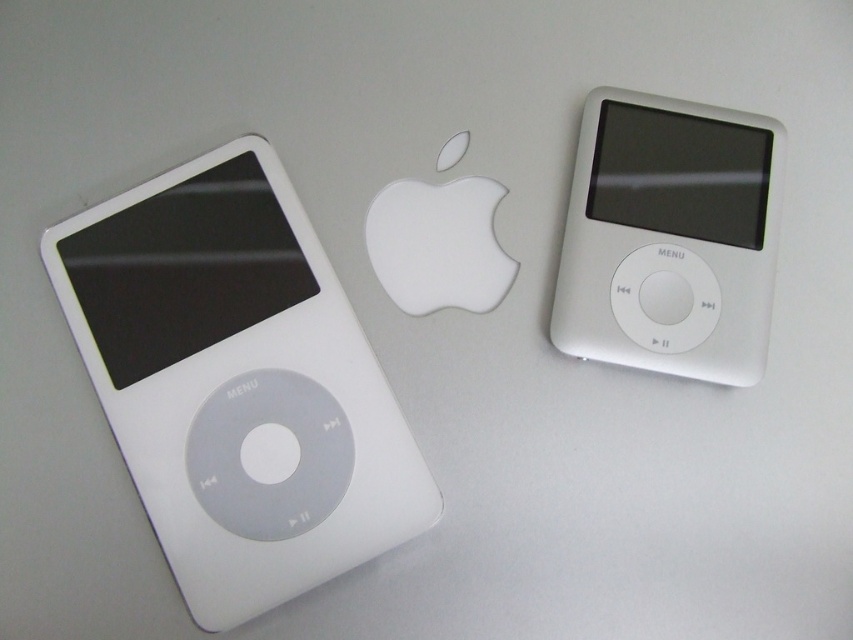
You are organizing a display at an electronics store and need to place the white matte ipod at left and the white matte ipod at right on a shelf. According to the image, which iPod should be placed on the left side of the shelf?

The white matte ipod at left should be placed on the left side of the shelf since it is positioned to the left of the white matte ipod at right in the image.

You are designing a display case for electronics and need to arrange the two white matte ipod models shown. Since space is limited, you want to place the larger one on the left side of the case and the smaller one on the right side. Does the current arrangement of the white matte ipod at left and the white matte ipod at right match your desired layout?

Yes, the current arrangement matches your desired layout because the white matte ipod at left is bigger than the white matte ipod at right, aligning with your requirement to place the larger one on the left and the smaller one on the right.

In the scene shown: You are setting up a display for a tech store and need to arrange the two white matte ipod at left and white matte ipod at right on a shelf. According to the image, which iPod should be placed lower on the shelf?

The white matte ipod at left should be placed lower on the shelf since it is positioned below the white matte ipod at right in the image.